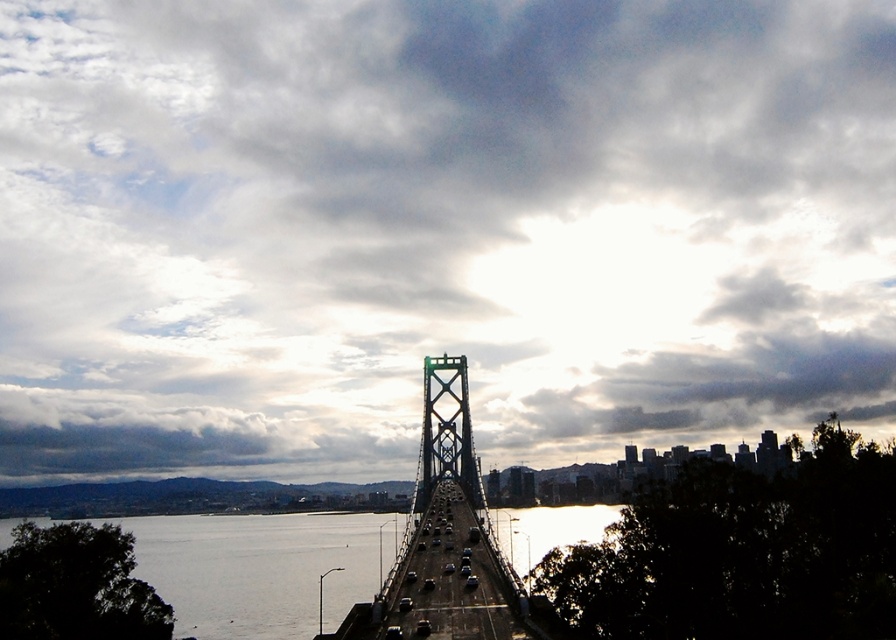
Does silvery water at center have a greater height compared to green metallic suspension bridge at center?

No, silvery water at center is not taller than green metallic suspension bridge at center.

Is point (239, 637) in front of point (420, 529)?

No, (239, 637) is further to viewer.

Which is behind, point (543, 509) or point (451, 448)?

The point (543, 509) is behind.

I want to click on silvery water at center, so click(x=259, y=568).